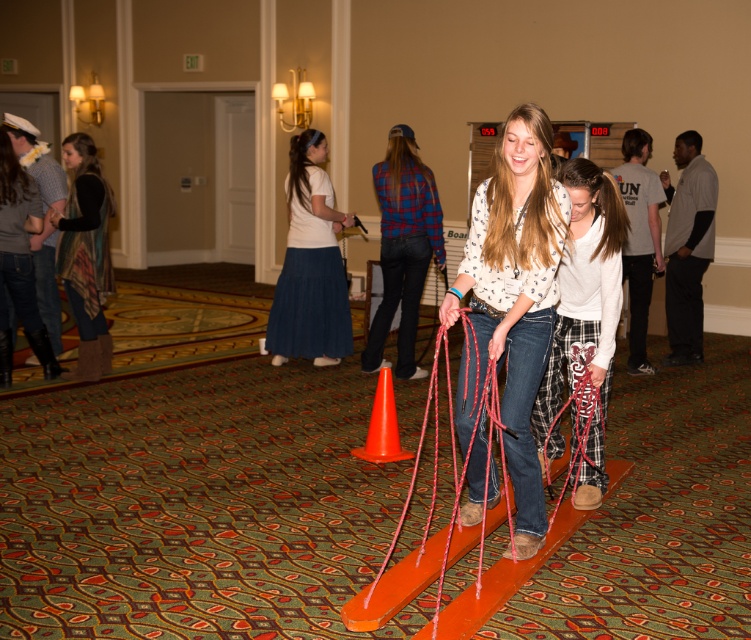
You are standing in the room and want to pick up the orange plastic traffic cone at center without touching the matte white blouse at center. Is this possible?

The matte white blouse at center is closer to the viewer than orange plastic traffic cone at center, so you can reach the orange plastic traffic cone at center without touching the matte white blouse at center by moving around it.

Where is the matte white blouse at center located in the image?

The matte white blouse at center is located at point 0.487 on the x axis and 0.680 on the y axis.

You are a photographer standing at the edge of the carpet. You want to take a photo of the fluffy white sweater at center and denim skirt at center so that both are in the frame. Given that your camera has a maximum focus range of 10 feet, will both items be in focus?

The fluffy white sweater at center is 10.12 feet from denim skirt at center. Since the distance between them is slightly over 10 feet, the camera might not be able to keep both in focus simultaneously.